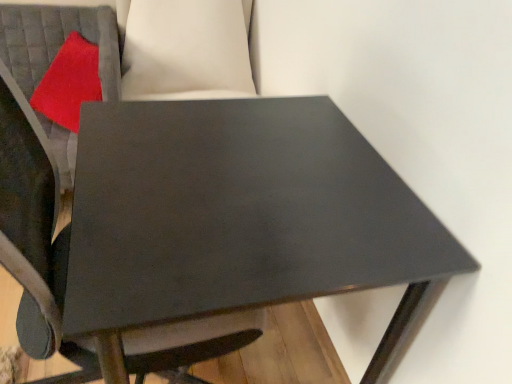
Question: Is red velvet pillow at upper left looking in the opposite direction of matte black table at center?

Choices:
 (A) yes
 (B) no

Answer: (B)

Question: Considering the relative sizes of red velvet pillow at upper left and matte black table at center in the image provided, is red velvet pillow at upper left shorter than matte black table at center?

Choices:
 (A) no
 (B) yes

Answer: (B)

Question: Considering the relative positions of red velvet pillow at upper left and matte black table at center in the image provided, is red velvet pillow at upper left to the right of matte black table at center from the viewer's perspective?

Choices:
 (A) no
 (B) yes

Answer: (A)

Question: From the image's perspective, is red velvet pillow at upper left over matte black table at center?

Choices:
 (A) yes
 (B) no

Answer: (A)

Question: Does red velvet pillow at upper left have a greater width compared to matte black table at center?

Choices:
 (A) no
 (B) yes

Answer: (A)

Question: Does red velvet pillow at upper left turn towards matte black table at center?

Choices:
 (A) no
 (B) yes

Answer: (B)

Question: Would you say matte black table at center is a long distance from red velvet pillow at upper left?

Choices:
 (A) yes
 (B) no

Answer: (B)

Question: Is matte black table at center further to camera compared to red velvet pillow at upper left?

Choices:
 (A) no
 (B) yes

Answer: (A)

Question: Does matte black table at center have a lesser height compared to red velvet pillow at upper left?

Choices:
 (A) yes
 (B) no

Answer: (B)

Question: From a real-world perspective, is matte black table at center beneath red velvet pillow at upper left?

Choices:
 (A) yes
 (B) no

Answer: (A)

Question: From the image's perspective, is matte black table at center below red velvet pillow at upper left?

Choices:
 (A) yes
 (B) no

Answer: (A)

Question: Does matte black table at center have a greater width compared to red velvet pillow at upper left?

Choices:
 (A) yes
 (B) no

Answer: (A)

Question: Is matte black table at center inside or outside of red velvet pillow at upper left?

Choices:
 (A) outside
 (B) inside

Answer: (A)